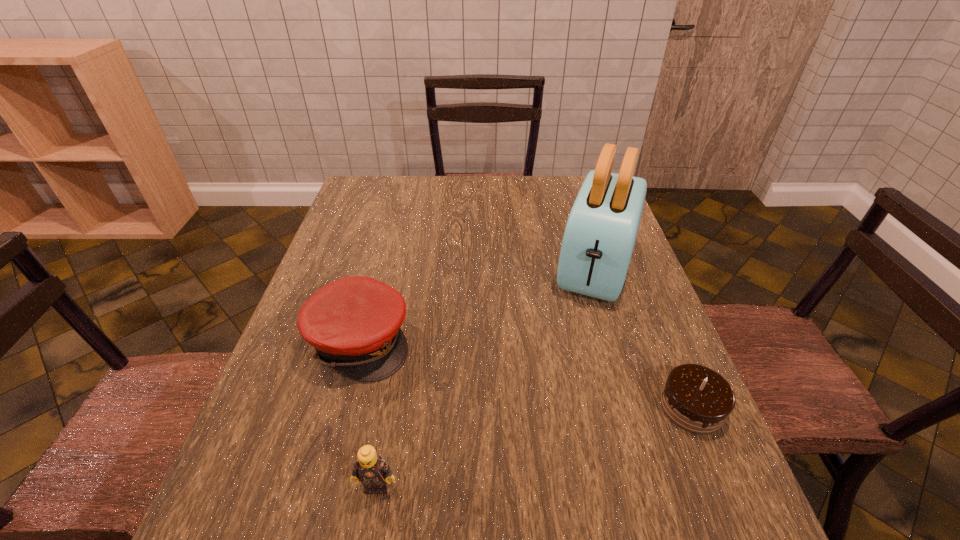
The image size is (960, 540). Find the location of `vacant space in between the cap and the shortest object`. vacant space in between the cap and the shortest object is located at coordinates (526, 374).

Where is `the third closest object to the tallest object`? the third closest object to the tallest object is located at coordinates (370, 469).

Where is `the closest object to the cap`? The height and width of the screenshot is (540, 960). the closest object to the cap is located at coordinates (370, 469).